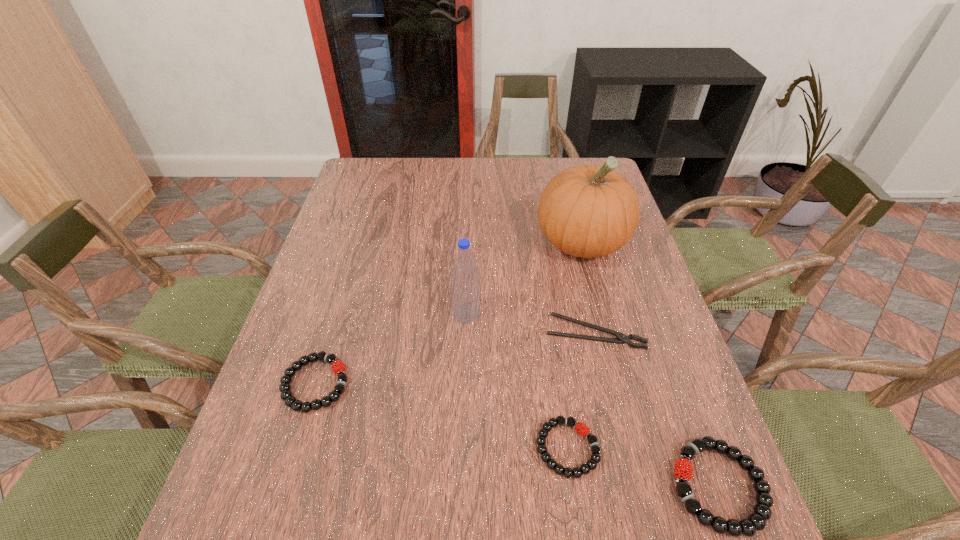
Locate an element on the screen. The image size is (960, 540). free space in the image that satisfies the following two spatial constraints: 1. on the back side of the tongs; 2. on the left side of the shortest bracelet is located at coordinates (551, 333).

The image size is (960, 540). I want to click on free space that satisfies the following two spatial constraints: 1. on the back side of the second bracelet from right to left; 2. on the left side of the tongs, so click(x=551, y=333).

Image resolution: width=960 pixels, height=540 pixels. What are the coordinates of `free space that satisfies the following two spatial constraints: 1. on the front side of the second bracelet from right to left; 2. on the right side of the rightmost bracelet` in the screenshot? It's located at (573, 486).